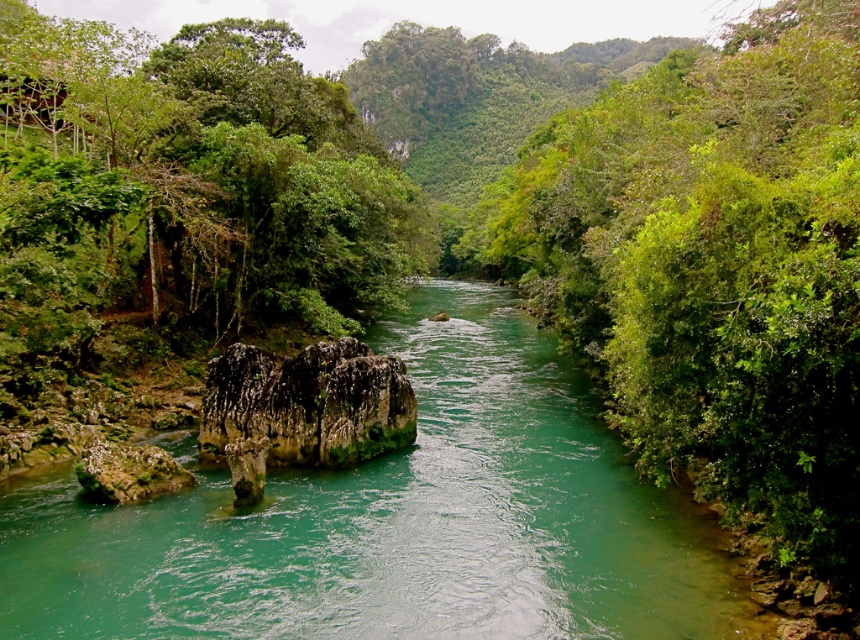
Between point (213, 586) and point (837, 74), which one is positioned in front?

Point (213, 586) is more forward.

Does green stone stream at center have a greater width compared to green leafy tree at right?

Indeed, green stone stream at center has a greater width compared to green leafy tree at right.

You are a GUI agent. You are given a task and a screenshot of the screen. Output one action in this format:
    pyautogui.click(x=<x>, y=<y>)
    Task: Click on the green stone stream at center
    The height and width of the screenshot is (640, 860).
    Given the screenshot: What is the action you would take?
    pyautogui.click(x=395, y=520)